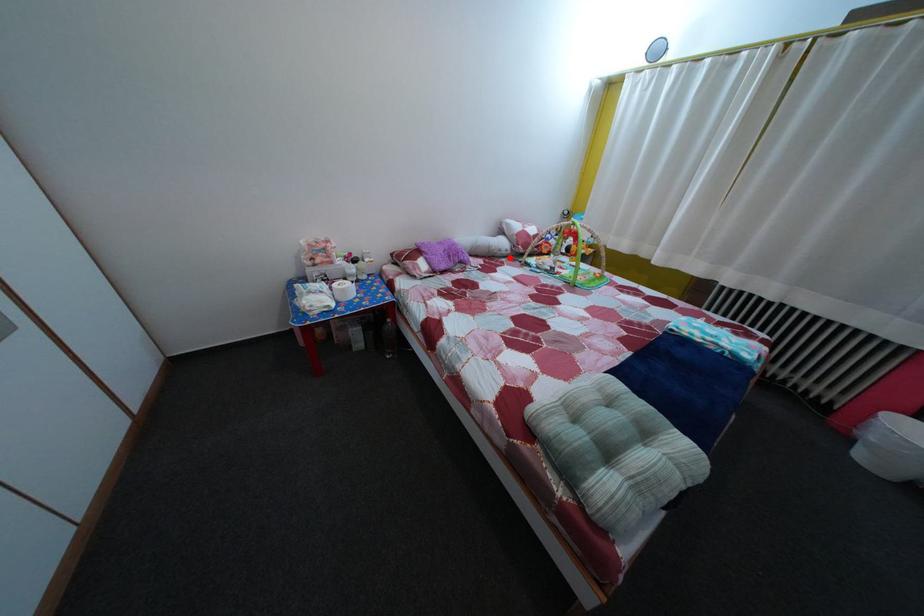
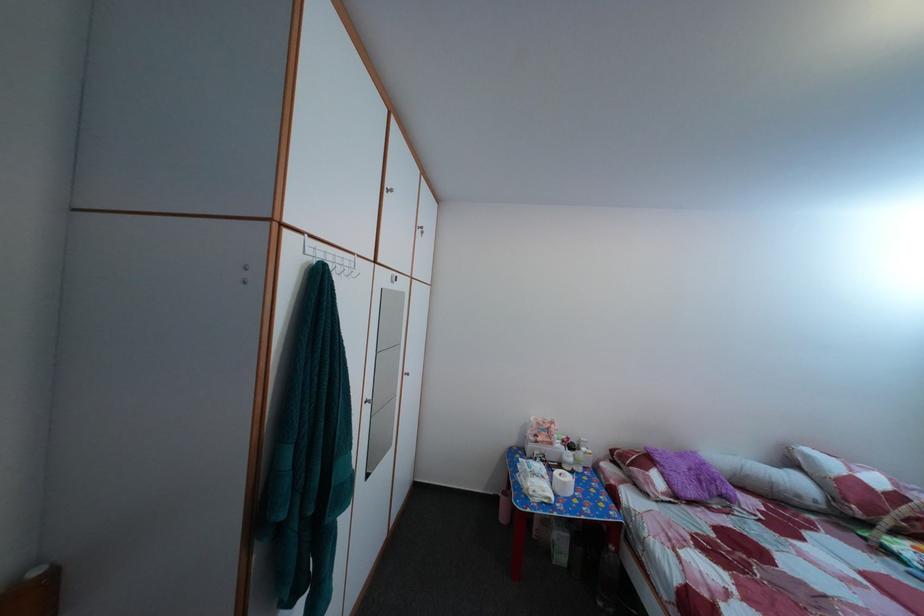
Where in the second image is the point corresponding to the highlighted location from the first image?

(808, 504)